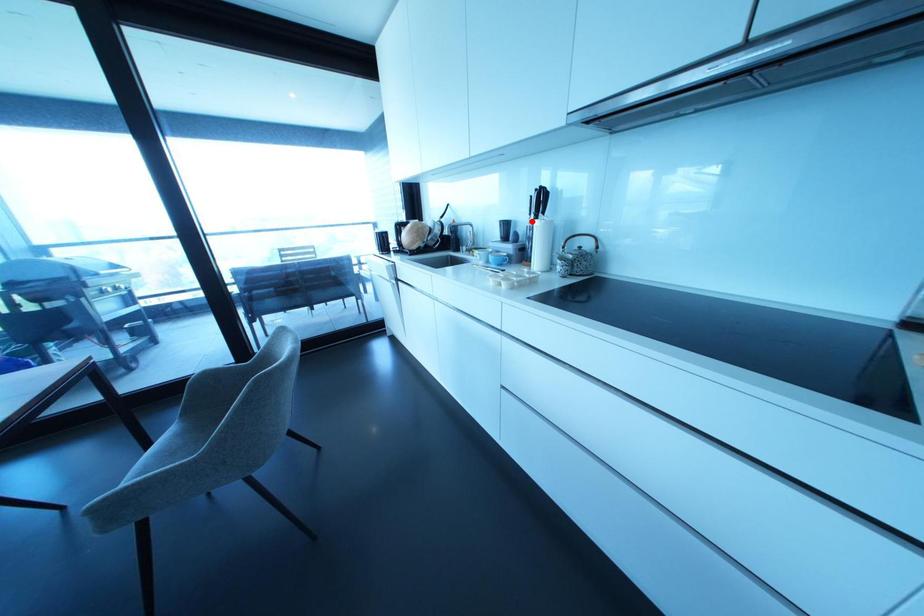
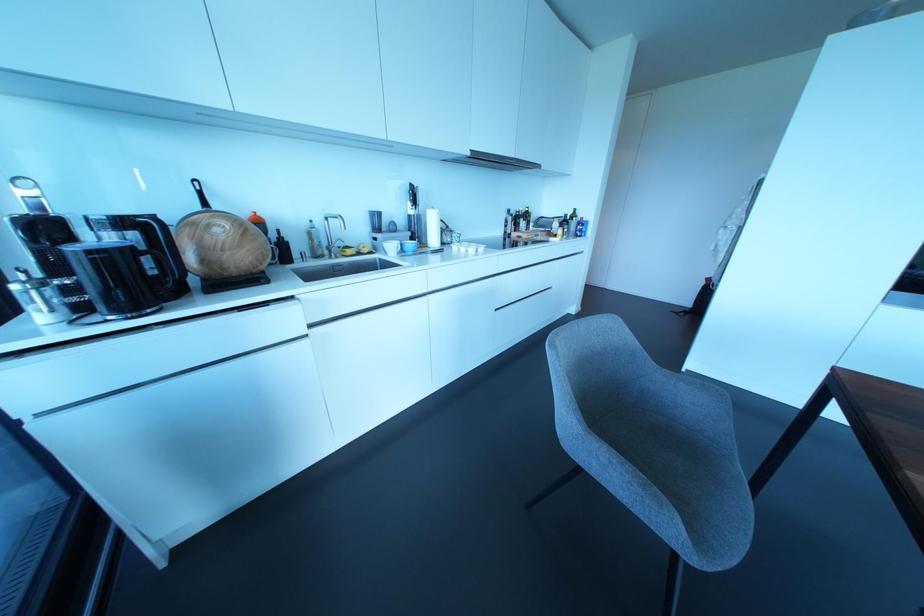
Where in the second image is the point corresponding to the highlighted location from the first image?

(410, 211)